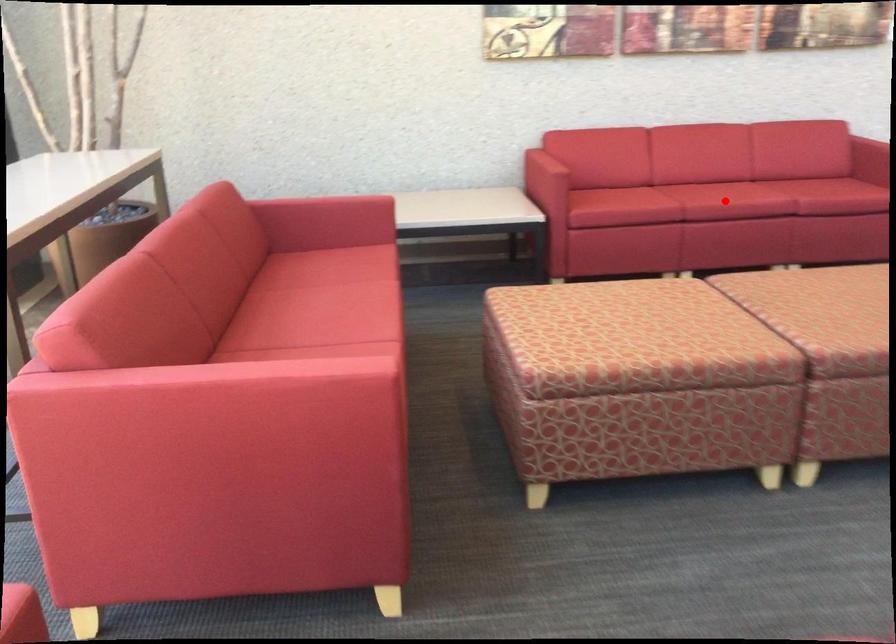
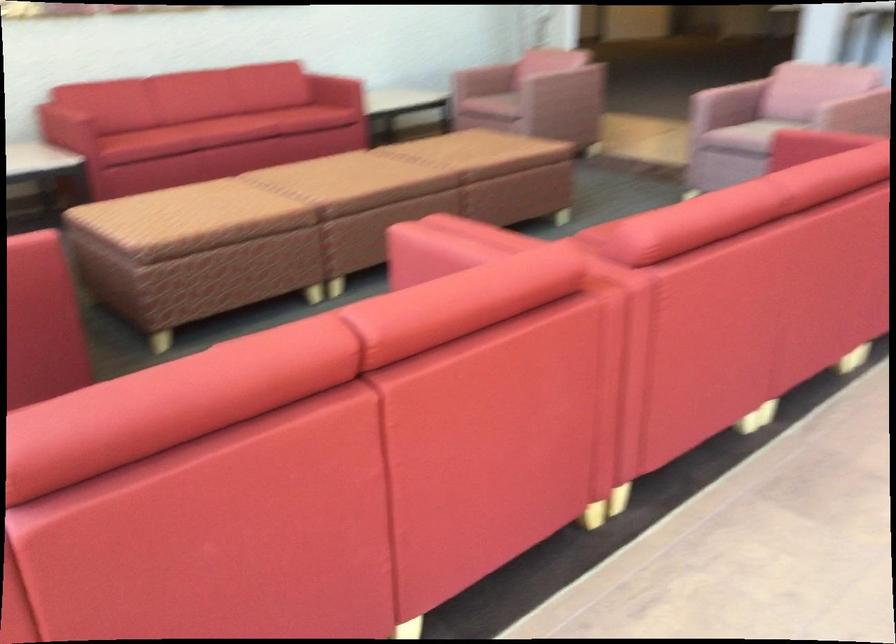
Locate, in the second image, the point that corresponds to the highlighted location in the first image.

(235, 129)